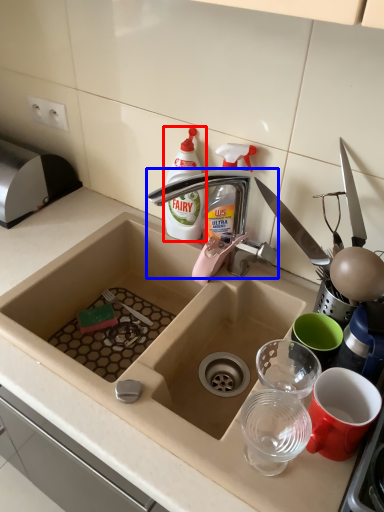
Question: Which object appears closest to the camera in this image, bottle (highlighted by a red box) or tap (highlighted by a blue box)?

Choices:
 (A) bottle
 (B) tap

Answer: (B)